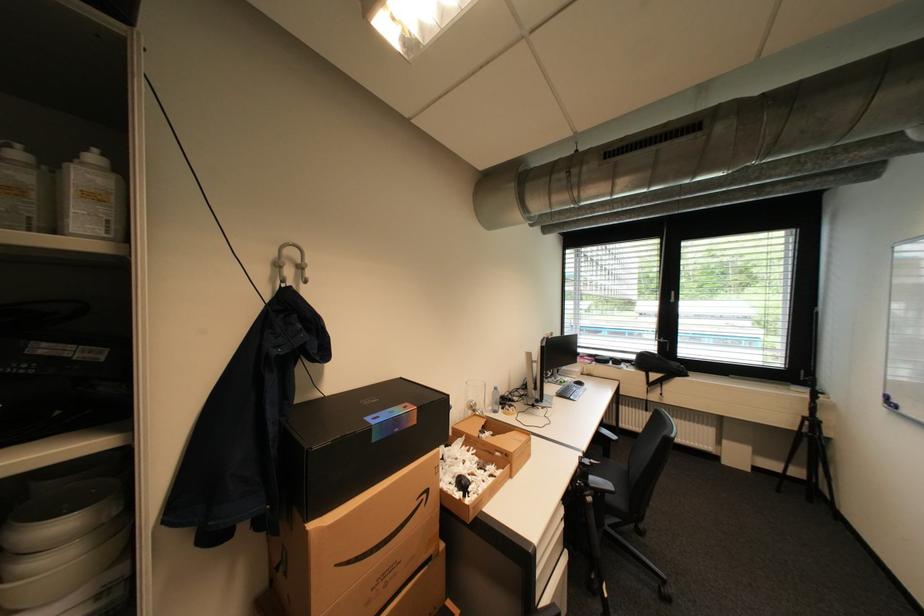
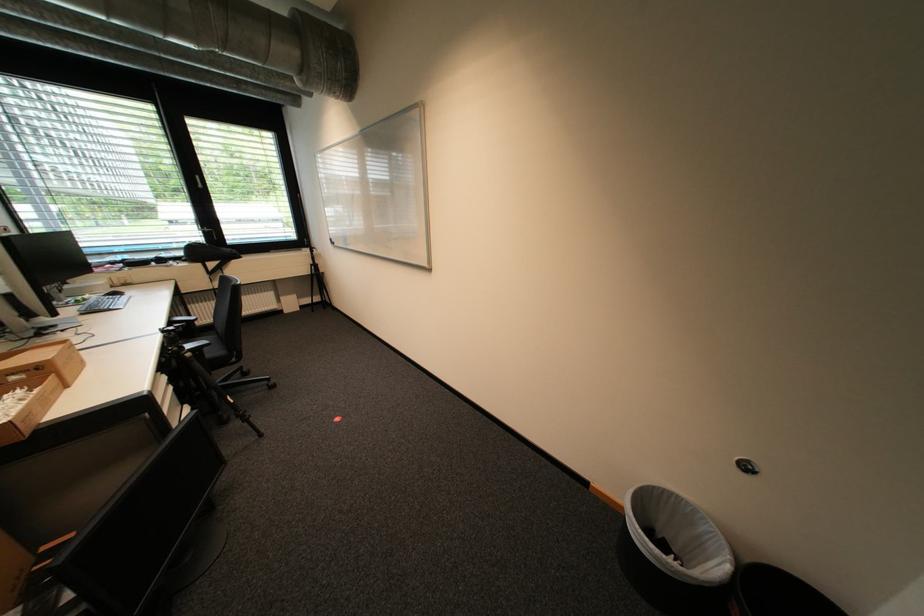
The point at [615,495] is marked in the first image. Where is the corresponding point in the second image?

(213, 350)